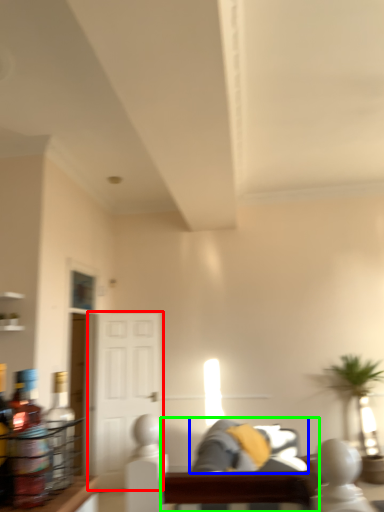
Question: Which is farther away from glass door (highlighted by a red box)? couch (highlighted by a blue box) or couch (highlighted by a green box)?

Choices:
 (A) couch
 (B) couch

Answer: (B)